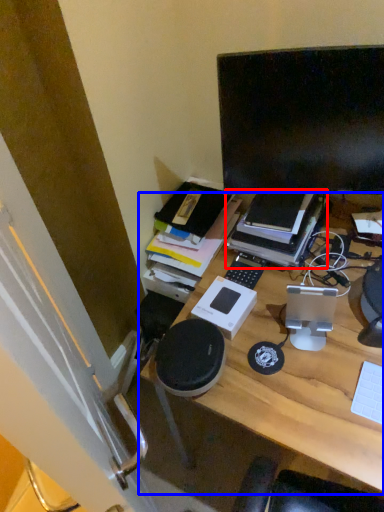
Question: Among these objects, which one is farthest to the camera, book (highlighted by a red box) or desk (highlighted by a blue box)?

Choices:
 (A) book
 (B) desk

Answer: (A)